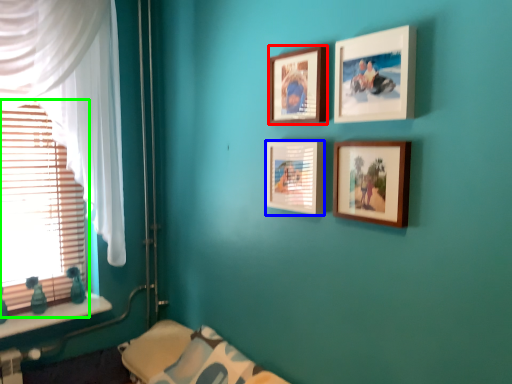
Question: Which object is positioned closest to picture frame (highlighted by a red box)? Select from picture frame (highlighted by a blue box) and window blind (highlighted by a green box).

Choices:
 (A) picture frame
 (B) window blind

Answer: (A)